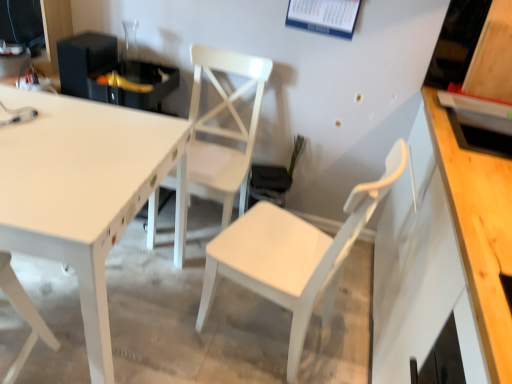
Locate an element on the screen. free spot below white matte chair at center, which is the 2th chair from right to left (from a real-world perspective) is located at coordinates (199, 222).